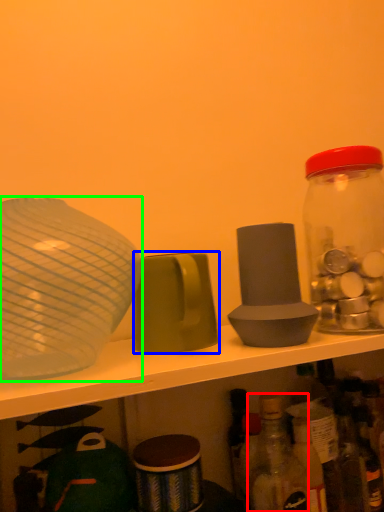
Question: Which is farther away from bottle (highlighted by a red box)? tableware (highlighted by a blue box) or tableware (highlighted by a green box)?

Choices:
 (A) tableware
 (B) tableware

Answer: (B)